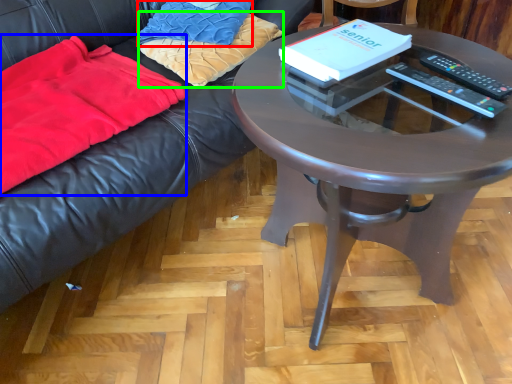
Question: Based on their relative distances, which object is nearer to pillow (highlighted by a red box)? Choose from blanket (highlighted by a blue box) and pillow (highlighted by a green box).

Choices:
 (A) blanket
 (B) pillow

Answer: (B)